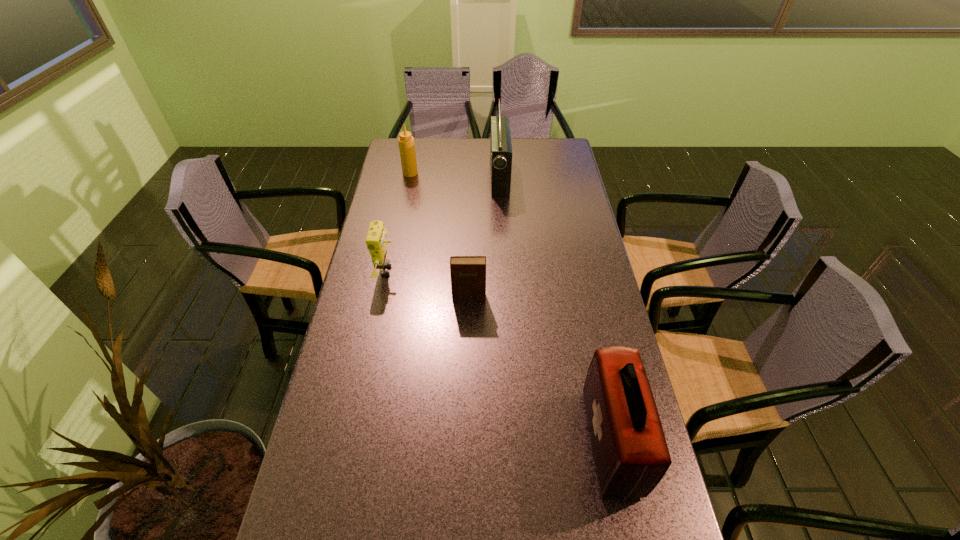
The width and height of the screenshot is (960, 540). I want to click on vacant area situated 0.200m on the side of the rightmost object with the cross symbol, so click(506, 442).

The image size is (960, 540). What are the coordinates of `free point located on the side of the rightmost object with the cross symbol` in the screenshot? It's located at (510, 442).

The height and width of the screenshot is (540, 960). I want to click on free space located 0.320m on the front of the condiment, so click(x=400, y=226).

I want to click on free space located on the face of the sponge, so click(x=430, y=271).

At what (x,y) coordinates should I click in order to perform the action: click on vacant space situated 0.050m on the front cover of the diary. Please return your answer as a coordinate pair (x, y). Looking at the image, I should click on (468, 314).

This screenshot has width=960, height=540. Identify the location of object that is positioned at the far edge. (500, 145).

Identify the location of condiment at the left edge. This screenshot has width=960, height=540. click(406, 141).

Find the location of `sponge that is at the left edge`. sponge that is at the left edge is located at coordinates (375, 240).

Locate an element on the screen. object at the right edge is located at coordinates (631, 455).

This screenshot has height=540, width=960. In the image, there is a desktop. What are the coordinates of `vacant space at the far edge` in the screenshot? It's located at (521, 155).